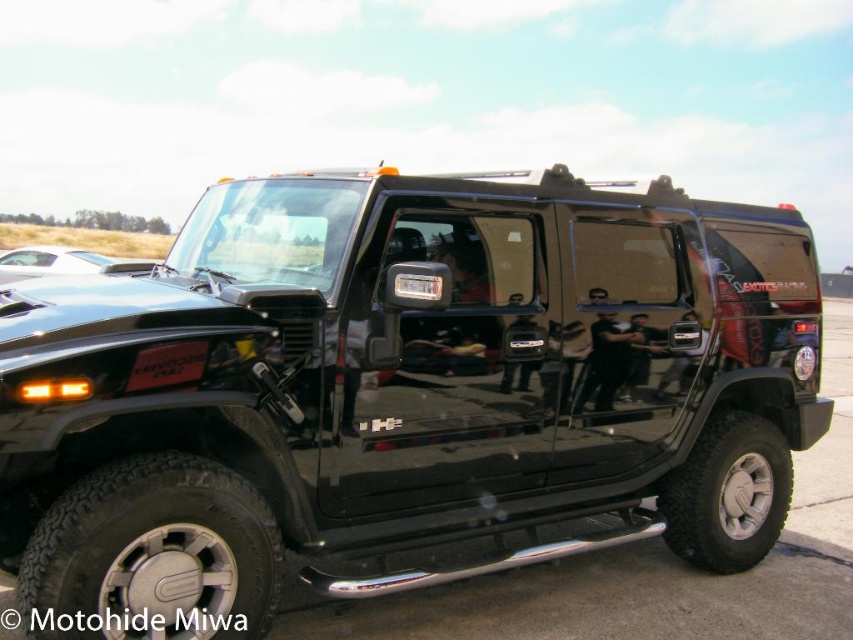
Question: Is glossy black suv at center bigger than black glossy license plate at center?

Choices:
 (A) yes
 (B) no

Answer: (A)

Question: Which object is farther from the camera taking this photo?

Choices:
 (A) black glossy license plate at center
 (B) glossy black suv at center

Answer: (A)

Question: Estimate the real-world distances between objects in this image. Which object is closer to the glossy black suv at center?

Choices:
 (A) glossy black car at upper left
 (B) black glossy license plate at center
 (C) black matte license plate at center

Answer: (C)

Question: Does glossy black car at upper left come behind black glossy license plate at center?

Choices:
 (A) yes
 (B) no

Answer: (A)

Question: Which of the following is the farthest from the observer?

Choices:
 (A) (428, 291)
 (B) (231, 563)

Answer: (A)

Question: Is the position of black matte license plate at center more distant than that of black glossy license plate at center?

Choices:
 (A) yes
 (B) no

Answer: (B)